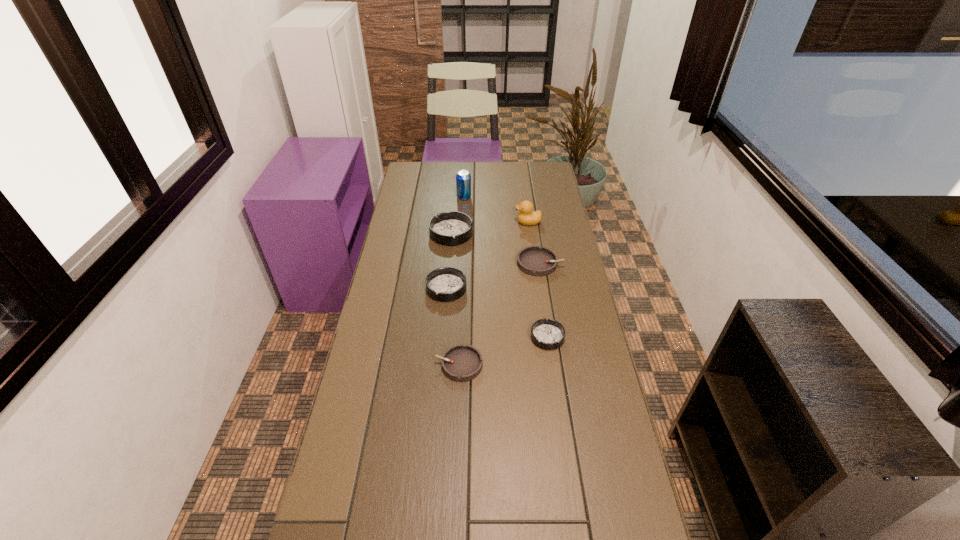
The width and height of the screenshot is (960, 540). What are the coordinates of `the nearest dark ashtray` in the screenshot? It's located at 549,334.

At what (x,y) coordinates should I click in order to perform the action: click on the smallest dark ashtray. Please return your answer as a coordinate pair (x, y). The height and width of the screenshot is (540, 960). Looking at the image, I should click on (549, 334).

The width and height of the screenshot is (960, 540). In order to click on free location located 0.370m on the front of the farthest object in this screenshot , I will do `click(461, 252)`.

Where is `vacant space located on the face of the sixth shortest object`? The height and width of the screenshot is (540, 960). vacant space located on the face of the sixth shortest object is located at coordinates (461, 222).

Locate an element on the screen. free space located 0.230m on the face of the sixth shortest object is located at coordinates (461, 222).

Identify the location of vacant space located on the face of the sixth shortest object. Image resolution: width=960 pixels, height=540 pixels. (482, 222).

Image resolution: width=960 pixels, height=540 pixels. What are the coordinates of `vacant space situated on the back of the farthest dark ashtray` in the screenshot? It's located at (453, 212).

This screenshot has height=540, width=960. Identify the location of free spot located on the front of the bigger gray ashtray. (548, 314).

You are a GUI agent. You are given a task and a screenshot of the screen. Output one action in this format:
    pyautogui.click(x=<x>, y=<y>)
    Task: Click on the free location located on the left of the second nearest dark ashtray
    The image size is (960, 540).
    Given the screenshot: What is the action you would take?
    pyautogui.click(x=401, y=288)

At what (x,y) coordinates should I click in order to perform the action: click on vacant area situated 0.250m on the front of the smaller gray ashtray. Please return your answer as a coordinate pair (x, y). Looking at the image, I should click on (455, 466).